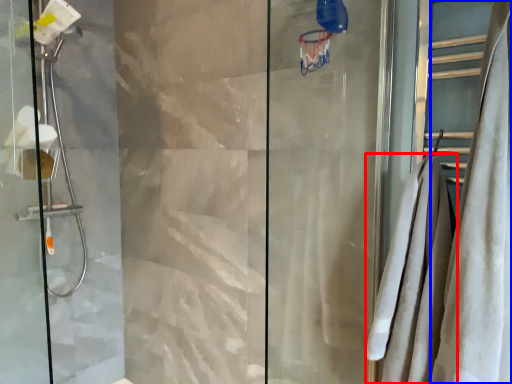
Question: Which point is further to the camera, bath towel (highlighted by a red box) or shower curtain (highlighted by a blue box)?

Choices:
 (A) bath towel
 (B) shower curtain

Answer: (A)